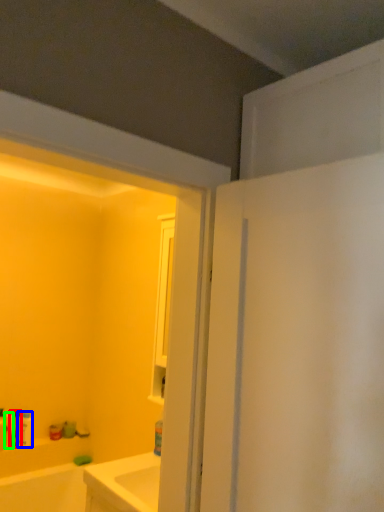
Question: Which object is the farthest from toiletry (highlighted by a red box)? Choose among these: toiletry (highlighted by a blue box) or toiletry (highlighted by a green box).

Choices:
 (A) toiletry
 (B) toiletry

Answer: (A)